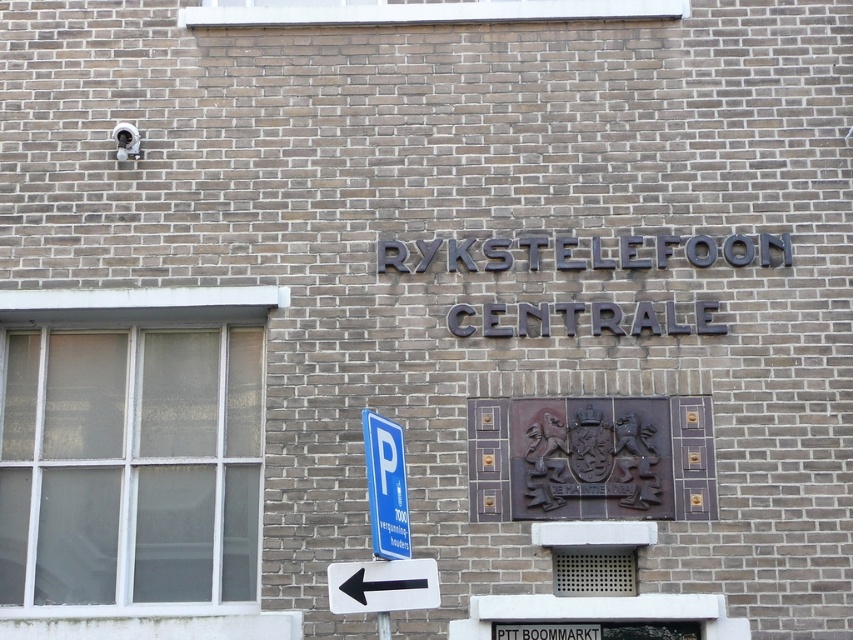
You are a delivery driver approaching the building and need to park. You see a blue metallic parking sign at lower left and a black plastic arrow at lower left. Which object is wider?

The blue metallic parking sign at lower left might be wider than black plastic arrow at lower left according to the description.

You are a driver approaching the building and see the blue metallic parking sign at lower left and the black plastic arrow at lower left. According to the objects in the scene, which object is closer to the ground?

The blue metallic parking sign at lower left is positioned under the black plastic arrow at lower left, so the blue metallic parking sign at lower left is closer to the ground.

You are a driver looking for a parking spot near the brick building with the RYKSTELEFOON CENTRALE sign. There is a blue plastic parking sign at lower left marked by point (386, 486). Can you determine if the parking sign is located to the left or right side of the building?

The blue plastic parking sign at lower left marked by point (386, 486) is located to the left side of the brick building with the RYKSTELEFOON CENTRALE sign.